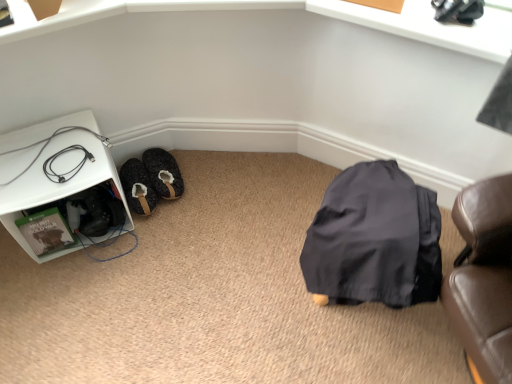
Identify the location of fuzzy fabric slipper at lower left. point(138,187).

Identify the location of fuzzy fabric slippers at lower left. Image resolution: width=512 pixels, height=384 pixels. (163, 173).

This screenshot has width=512, height=384. What do you see at coordinates (163, 173) in the screenshot?
I see `fuzzy fabric slippers at lower left` at bounding box center [163, 173].

Where is `white plastic shelf at left`? white plastic shelf at left is located at coordinates (58, 186).

From a real-world perspective, which object stands above the other?

white plastic shelf at left.

Considering the positions of point (162, 152) and point (106, 164), is point (162, 152) closer or farther from the camera than point (106, 164)?

Point (162, 152) is positioned farther from the camera compared to point (106, 164).

Is fuzzy fabric slippers at lower left next to white plastic shelf at left and touching it?

No, fuzzy fabric slippers at lower left is not in contact with white plastic shelf at left.

In terms of size, does fuzzy fabric slippers at lower left appear bigger or smaller than white plastic shelf at left?

In the image, fuzzy fabric slippers at lower left appears to be smaller than white plastic shelf at left.

Considering the relative sizes of fuzzy fabric slippers at lower left and fuzzy fabric slipper at lower left in the image provided, is fuzzy fabric slippers at lower left wider than fuzzy fabric slipper at lower left?

Indeed, fuzzy fabric slippers at lower left has a greater width compared to fuzzy fabric slipper at lower left.

Between fuzzy fabric slippers at lower left and fuzzy fabric slipper at lower left, which one appears on the left side from the viewer's perspective?

From the viewer's perspective, fuzzy fabric slipper at lower left appears more on the left side.

Which is correct: fuzzy fabric slippers at lower left is inside fuzzy fabric slipper at lower left, or outside of it?

fuzzy fabric slippers at lower left cannot be found inside fuzzy fabric slipper at lower left.

Identify the location of shoe that is on the left side of fuzzy fabric slippers at lower left. The height and width of the screenshot is (384, 512). (138, 187).

Can you confirm if fuzzy fabric slipper at lower left is bigger than black rubber cable at lower left?

Indeed, fuzzy fabric slipper at lower left has a larger size compared to black rubber cable at lower left.

Are fuzzy fabric slipper at lower left and black rubber cable at lower left beside each other?

No, fuzzy fabric slipper at lower left is not with black rubber cable at lower left.

Identify the location of wire located on the left of fuzzy fabric slipper at lower left. (69, 170).

Can you confirm if white plastic shelf at left is positioned to the left of fuzzy fabric slippers at lower left?

Indeed, white plastic shelf at left is positioned on the left side of fuzzy fabric slippers at lower left.

Looking at this image, which object is further away from the camera taking this photo, white plastic shelf at left or fuzzy fabric slippers at lower left?

fuzzy fabric slippers at lower left is behind.

Considering the relative sizes of white plastic shelf at left and fuzzy fabric slippers at lower left in the image provided, is white plastic shelf at left shorter than fuzzy fabric slippers at lower left?

Incorrect, the height of white plastic shelf at left does not fall short of that of fuzzy fabric slippers at lower left.

Is fuzzy fabric slippers at lower left located within white plastic shelf at left?

No, fuzzy fabric slippers at lower left is located outside of white plastic shelf at left.

Identify the location of footwear lying on the right of black rubber cable at lower left. (163, 173).

From the image's perspective, would you say black rubber cable at lower left is positioned over fuzzy fabric slippers at lower left?

Indeed, from the image's perspective, black rubber cable at lower left is shown above fuzzy fabric slippers at lower left.

Can you confirm if black rubber cable at lower left is positioned to the right of fuzzy fabric slippers at lower left?

In fact, black rubber cable at lower left is to the left of fuzzy fabric slippers at lower left.

From a real-world perspective, is white plastic shelf at left physically above black rubber cable at lower left?

No, from a real-world perspective, white plastic shelf at left is not above black rubber cable at lower left.

Do you think white plastic shelf at left is within black rubber cable at lower left, or outside of it?

white plastic shelf at left is spatially situated outside black rubber cable at lower left.

Consider the image. From a real-world perspective, is fuzzy fabric slipper at lower left located beneath fuzzy fabric slippers at lower left?

No, from a real-world perspective, fuzzy fabric slipper at lower left is not below fuzzy fabric slippers at lower left.

From the image's perspective, is fuzzy fabric slipper at lower left located above or below fuzzy fabric slippers at lower left?

Based on their image positions, fuzzy fabric slipper at lower left is located beneath fuzzy fabric slippers at lower left.

Is fuzzy fabric slipper at lower left facing away from fuzzy fabric slippers at lower left?

That's not correct — fuzzy fabric slipper at lower left is not looking away from fuzzy fabric slippers at lower left.

Where is `furniture below the fuzzy fabric slippers at lower left (from the image's perspective)`? furniture below the fuzzy fabric slippers at lower left (from the image's perspective) is located at coordinates (58, 186).

Find the location of a particular element. The width and height of the screenshot is (512, 384). footwear to the right of fuzzy fabric slipper at lower left is located at coordinates (163, 173).

Estimate the real-world distances between objects in this image. Which object is further from black rubber cable at lower left, fuzzy fabric slipper at lower left or fuzzy fabric slippers at lower left?

fuzzy fabric slippers at lower left is positioned further to the anchor black rubber cable at lower left.

Based on their spatial positions, is black rubber cable at lower left or white plastic shelf at left further from fuzzy fabric slipper at lower left?

black rubber cable at lower left.

Which object lies further to the anchor point white plastic shelf at left, fuzzy fabric slipper at lower left or fuzzy fabric slippers at lower left?

Based on the image, fuzzy fabric slippers at lower left appears to be further to white plastic shelf at left.

Estimate the real-world distances between objects in this image. Which object is closer to fuzzy fabric slipper at lower left, white plastic shelf at left or fuzzy fabric slippers at lower left?

Based on the image, fuzzy fabric slippers at lower left appears to be nearer to fuzzy fabric slipper at lower left.

Estimate the real-world distances between objects in this image. Which object is closer to fuzzy fabric slippers at lower left, white plastic shelf at left or black rubber cable at lower left?

Based on the image, white plastic shelf at left appears to be nearer to fuzzy fabric slippers at lower left.

Based on their spatial positions, is black rubber cable at lower left or white plastic shelf at left further from fuzzy fabric slippers at lower left?

black rubber cable at lower left lies further to fuzzy fabric slippers at lower left than the other object.

Considering their positions, is fuzzy fabric slippers at lower left positioned closer to black rubber cable at lower left than white plastic shelf at left?

Based on the image, white plastic shelf at left appears to be nearer to black rubber cable at lower left.

Which object lies further to the anchor point black rubber cable at lower left, fuzzy fabric slippers at lower left or fuzzy fabric slipper at lower left?

fuzzy fabric slippers at lower left.

Locate an element on the screen. shoe between black rubber cable at lower left and fuzzy fabric slippers at lower left in the front-back direction is located at coordinates (138, 187).

Image resolution: width=512 pixels, height=384 pixels. Find the location of `wire located between white plastic shelf at left and fuzzy fabric slipper at lower left in the depth direction`. wire located between white plastic shelf at left and fuzzy fabric slipper at lower left in the depth direction is located at coordinates (69, 170).

This screenshot has width=512, height=384. In order to click on shoe positioned between white plastic shelf at left and fuzzy fabric slippers at lower left from near to far in this screenshot , I will do `click(138, 187)`.

I want to click on wire between white plastic shelf at left and fuzzy fabric slippers at lower left, so click(x=69, y=170).